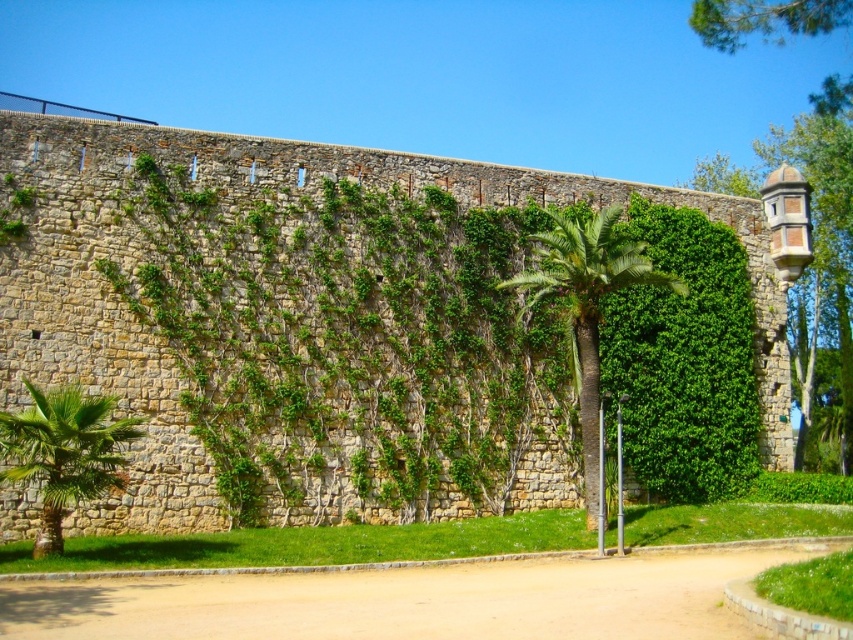
In the scene shown: Who is shorter, green leafy palm at center or green leafy palm tree at lower left?

green leafy palm tree at lower left

From the picture: Does green leafy palm at center have a lesser height compared to green leafy palm tree at lower left?

No, green leafy palm at center is not shorter than green leafy palm tree at lower left.

Who is more distant from viewer, (x=585, y=378) or (x=68, y=396)?

Point (x=585, y=378)

Find the location of `green leafy palm at center`. green leafy palm at center is located at coordinates (587, 312).

Who is positioned more to the left, green leafy hedge at center or green leafy palm at center?

From the viewer's perspective, green leafy hedge at center appears more on the left side.

Describe the element at coordinates (354, 340) in the screenshot. The height and width of the screenshot is (640, 853). I see `green leafy hedge at center` at that location.

The image size is (853, 640). In order to click on green leafy hedge at center in this screenshot , I will do `click(354, 340)`.

Can you confirm if green leafy palm tree at lower left is positioned to the right of metallic pole at lower center?

Incorrect, green leafy palm tree at lower left is not on the right side of metallic pole at lower center.

Is point (28, 417) positioned after point (618, 520)?

No, (28, 417) is closer to viewer.

Which is behind, point (56, 452) or point (616, 493)?

Point (616, 493)

Locate an element on the screen. Image resolution: width=853 pixels, height=640 pixels. green leafy palm tree at lower left is located at coordinates (64, 452).